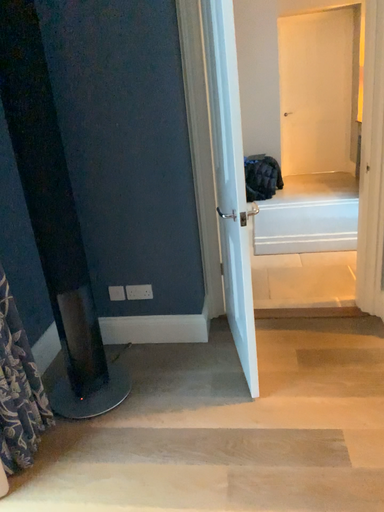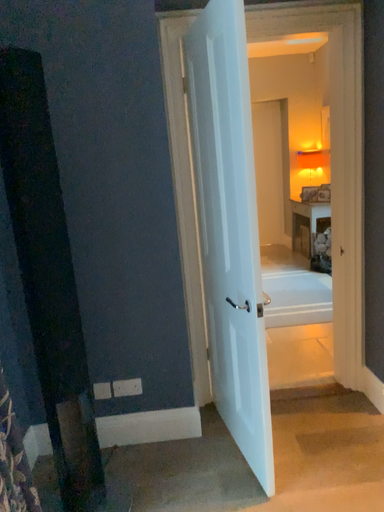
Question: How did the camera likely rotate when shooting the video?

Choices:
 (A) rotated downward
 (B) rotated upward

Answer: (B)